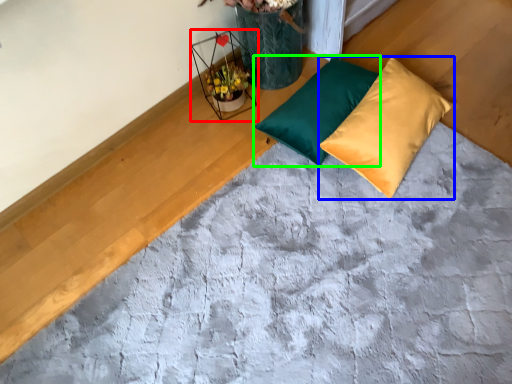
Question: Which is nearer to the flower basket (highlighted by a red box)? pillow (highlighted by a blue box) or pillow (highlighted by a green box).

Choices:
 (A) pillow
 (B) pillow

Answer: (B)